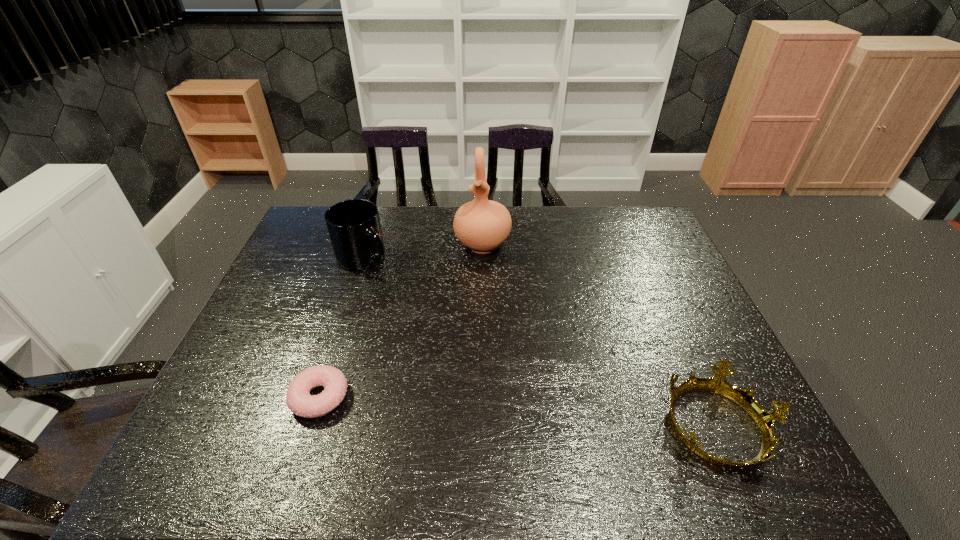
Where is `doughnut`? doughnut is located at coordinates (299, 401).

Locate an element on the screen. The image size is (960, 540). crown is located at coordinates (765, 420).

Find the location of a particular element. The width and height of the screenshot is (960, 540). the rightmost object is located at coordinates (765, 420).

Locate an element on the screen. This screenshot has width=960, height=540. mug is located at coordinates (354, 227).

This screenshot has width=960, height=540. I want to click on pottery, so click(x=482, y=225).

Locate an element on the screen. the tallest object is located at coordinates (482, 225).

You are a GUI agent. You are given a task and a screenshot of the screen. Output one action in this format:
    pyautogui.click(x=<x>, y=<y>)
    Task: Click on the vacant space located 0.320m on the back of the shortest object
    
    Given the screenshot: What is the action you would take?
    tap(355, 286)

Identify the location of free space located on the back of the crown. This screenshot has width=960, height=540. (x=672, y=322).

Locate an element on the screen. free region located with the handle on the side of the second tallest object is located at coordinates (422, 334).

The height and width of the screenshot is (540, 960). Find the location of `free space located 0.360m with the handle on the side of the second tallest object`. free space located 0.360m with the handle on the side of the second tallest object is located at coordinates (431, 346).